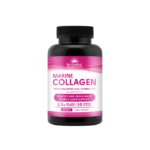
The image size is (150, 150). Find the location of `bottle`. bottle is located at coordinates [71, 123].